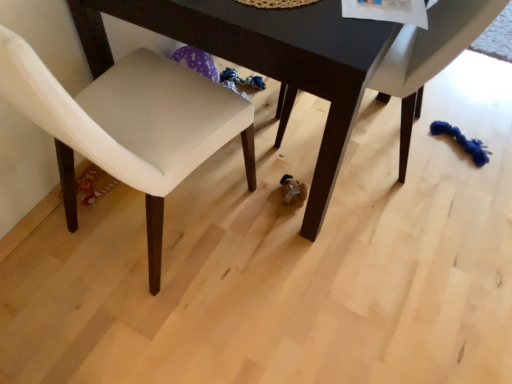
What are the coordinates of `vacant space in white leather chair at lower left, which is counted as the first chair, starting from the left (from a real-world perspective)` in the screenshot? It's located at (163, 230).